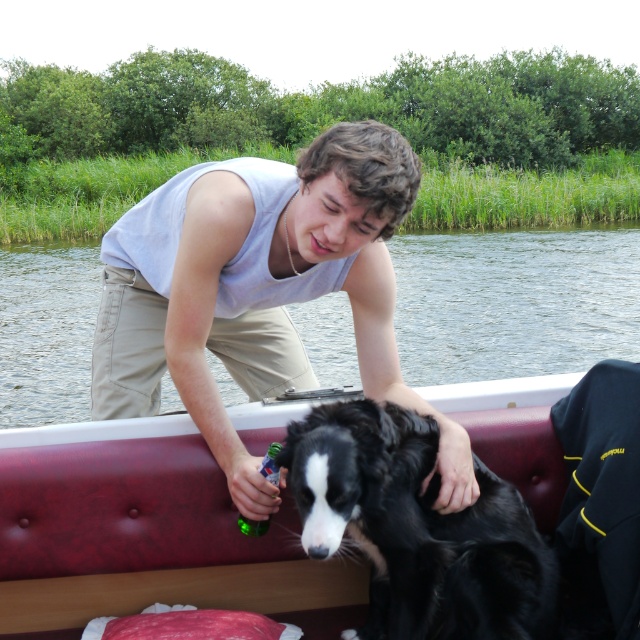
Which is below, smooth leather boat at center or clear water at boat center?

Positioned lower is smooth leather boat at center.

Is point (280, 592) positioned before point (84, 253)?

Yes, point (280, 592) is in front of point (84, 253).

Locate an element on the screen. The width and height of the screenshot is (640, 640). smooth leather boat at center is located at coordinates (141, 532).

Measure the distance between smooth leather boat at center and camera.

smooth leather boat at center and camera are 2.56 meters apart.

Is point (202, 550) less distant than point (528, 605)?

No, it is not.

This screenshot has width=640, height=640. What do you see at coordinates (141, 532) in the screenshot?
I see `smooth leather boat at center` at bounding box center [141, 532].

You are a GUI agent. You are given a task and a screenshot of the screen. Output one action in this format:
    pyautogui.click(x=<x>, y=<y>)
    Task: Click on the smooth leather boat at center
    Image resolution: width=640 pixels, height=640 pixels.
    Given the screenshot: What is the action you would take?
    pyautogui.click(x=141, y=532)

Which is more to the right, gray cotton tank top at upper center or clear water at boat center?

From the viewer's perspective, gray cotton tank top at upper center appears more on the right side.

Which is in front, point (173, 216) or point (512, 236)?

Point (173, 216) is more forward.

Is point (390, 355) positioned behind point (54, 324)?

No, (390, 355) is in front of (54, 324).

This screenshot has height=640, width=640. I want to click on gray cotton tank top at upper center, so click(259, 291).